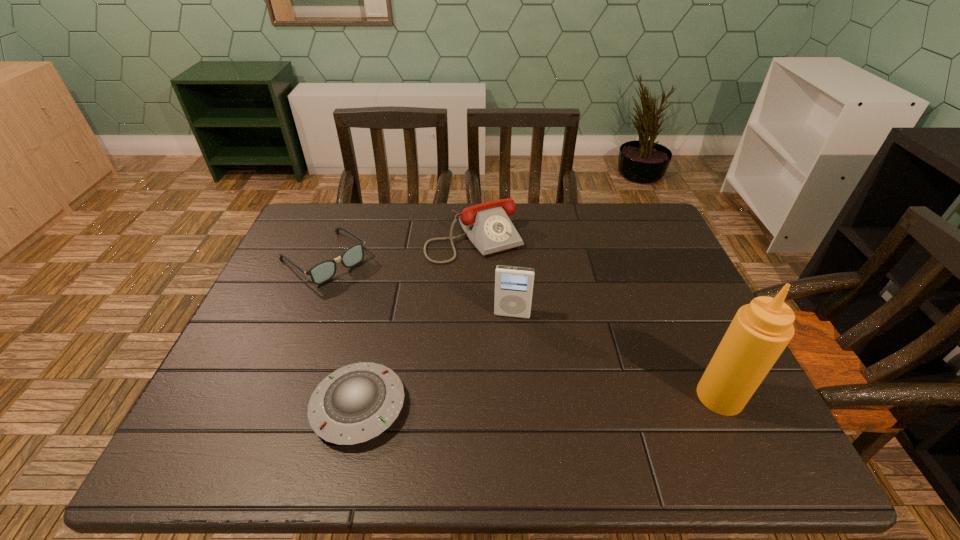
I want to click on vacant space at the near left corner of the desktop, so click(246, 392).

The image size is (960, 540). I want to click on free space at the far right corner, so click(661, 224).

I want to click on free space at the near right corner of the desktop, so click(753, 411).

In order to click on free point between the telephone and the shortest object in this screenshot , I will do pyautogui.click(x=417, y=322).

Locate an element on the screen. free point between the rightmost object and the saucer is located at coordinates (x=540, y=402).

Image resolution: width=960 pixels, height=540 pixels. What are the coordinates of `vacant space in between the third farthest object and the saucer` in the screenshot? It's located at (436, 361).

What are the coordinates of `free spot between the second tallest object and the telephone` in the screenshot? It's located at (493, 276).

The height and width of the screenshot is (540, 960). What are the coordinates of `empty space between the fourth shortest object and the saucer` in the screenshot? It's located at (436, 361).

Identify the location of vacant region between the condiment and the shortest object. (540, 402).

Image resolution: width=960 pixels, height=540 pixels. I want to click on free spot between the third tallest object and the saucer, so click(x=417, y=322).